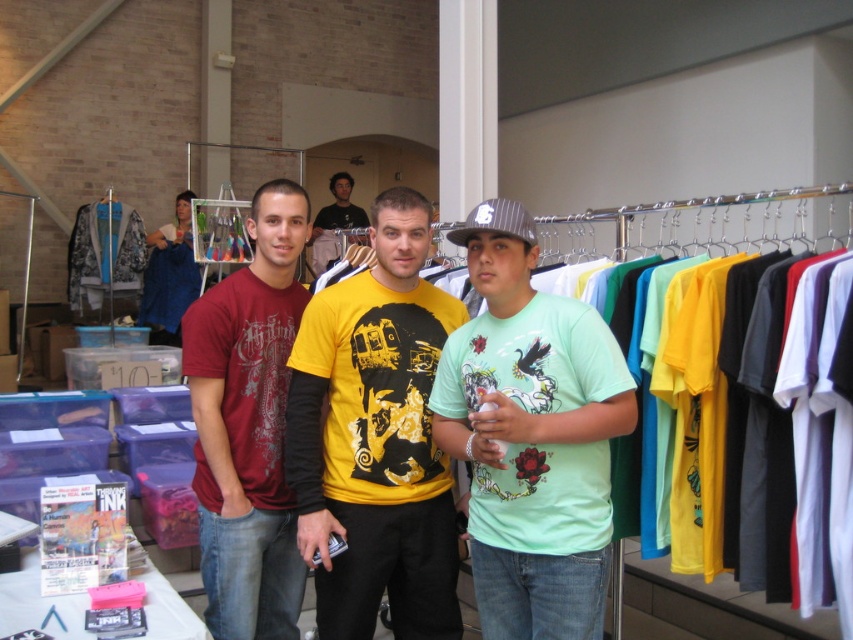
Question: Based on their relative distances, which object is nearer to the yellow printed t-shirt at center?

Choices:
 (A) yellow matte t-shirt at center
 (B) gray striped baseball cap at center
 (C) light green matte t-shirt at center

Answer: (C)

Question: Does yellow matte t-shirt at center appear under gray striped baseball cap at center?

Choices:
 (A) yes
 (B) no

Answer: (B)

Question: Considering the real-world distances, which object is farthest from the matte red t-shirt at left?

Choices:
 (A) yellow printed t-shirt at center
 (B) yellow matte t-shirt at center
 (C) light green matte t-shirt at center
 (D) gray striped baseball cap at center

Answer: (B)

Question: Can you confirm if matte red t-shirt at left is positioned below gray striped baseball cap at center?

Choices:
 (A) no
 (B) yes

Answer: (B)

Question: Does yellow matte t-shirt at center appear on the left side of gray striped baseball cap at center?

Choices:
 (A) no
 (B) yes

Answer: (B)

Question: Which point is closer to the camera?

Choices:
 (A) matte red t-shirt at left
 (B) gray striped baseball cap at center
 (C) yellow printed t-shirt at center
 (D) light green matte t-shirt at center

Answer: (D)